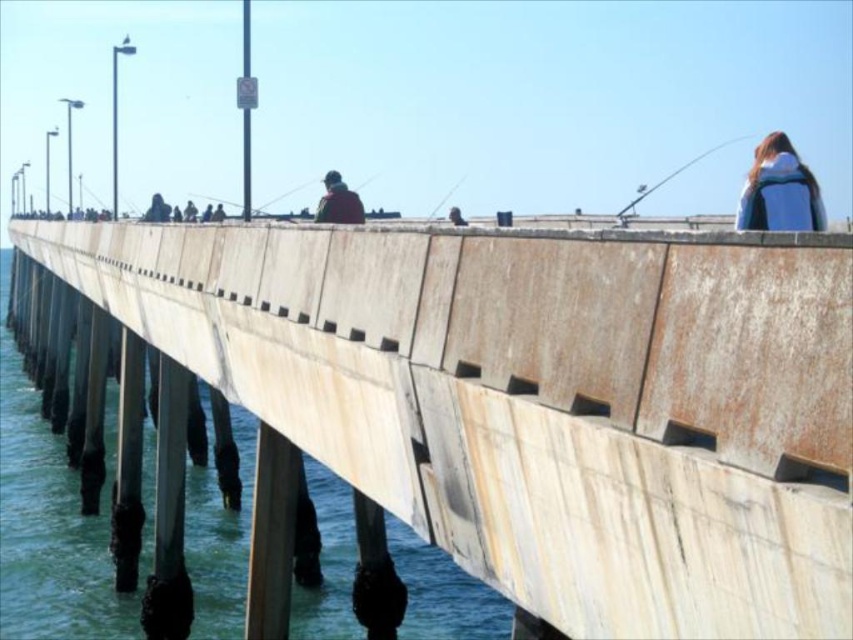
Question: Is rusty concrete bridge at center bigger than matte black fishing pole at upper right?

Choices:
 (A) no
 (B) yes

Answer: (A)

Question: Which of the following is the closest to the observer?

Choices:
 (A) (628, 209)
 (B) (764, 204)
 (C) (343, 216)

Answer: (B)

Question: Which is nearer to the blue backpack at upper right?

Choices:
 (A) rusty concrete bridge at center
 (B) matte black fishing pole at upper right
 (C) reddish-brown leather jacket at center

Answer: (C)

Question: Does blue backpack at upper right lie in front of matte black fishing pole at upper right?

Choices:
 (A) no
 (B) yes

Answer: (B)

Question: Estimate the real-world distances between objects in this image. Which object is closer to the reddish-brown leather jacket at center?

Choices:
 (A) matte black fishing pole at upper right
 (B) blue backpack at upper right
 (C) rusty concrete bridge at center

Answer: (C)

Question: Can you confirm if reddish-brown leather jacket at center is positioned below matte black fishing pole at upper right?

Choices:
 (A) yes
 (B) no

Answer: (A)